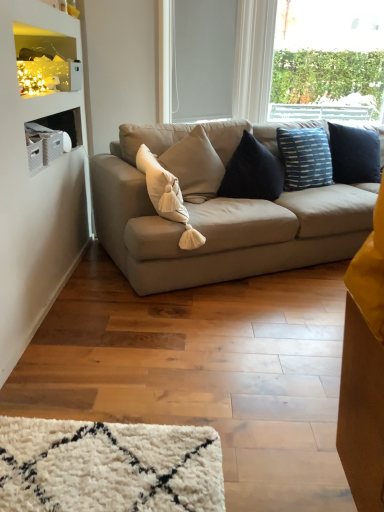
Question: From the image's perspective, is suede beige couch at center under white matte window screen at upper center?

Choices:
 (A) yes
 (B) no

Answer: (A)

Question: Considering the relative sizes of suede beige couch at center and white matte window screen at upper center in the image provided, is suede beige couch at center smaller than white matte window screen at upper center?

Choices:
 (A) no
 (B) yes

Answer: (A)

Question: From the image's perspective, does suede beige couch at center appear higher than white matte window screen at upper center?

Choices:
 (A) no
 (B) yes

Answer: (A)

Question: From a real-world perspective, is suede beige couch at center on white matte window screen at upper center?

Choices:
 (A) yes
 (B) no

Answer: (B)

Question: Is suede beige couch at center shorter than white matte window screen at upper center?

Choices:
 (A) no
 (B) yes

Answer: (B)

Question: From a real-world perspective, is suede beige couch at center beneath white matte window screen at upper center?

Choices:
 (A) no
 (B) yes

Answer: (B)

Question: Does beige fabric pillow at center have a smaller size compared to suede beige couch at center?

Choices:
 (A) yes
 (B) no

Answer: (A)

Question: From a real-world perspective, does beige fabric pillow at center sit lower than suede beige couch at center?

Choices:
 (A) no
 (B) yes

Answer: (A)

Question: Considering the relative positions of beige fabric pillow at center and suede beige couch at center in the image provided, is beige fabric pillow at center behind suede beige couch at center?

Choices:
 (A) no
 (B) yes

Answer: (B)

Question: Can you confirm if beige fabric pillow at center is taller than suede beige couch at center?

Choices:
 (A) no
 (B) yes

Answer: (A)

Question: From the image's perspective, is beige fabric pillow at center beneath suede beige couch at center?

Choices:
 (A) no
 (B) yes

Answer: (B)

Question: Would you say beige fabric pillow at center is a long distance from suede beige couch at center?

Choices:
 (A) no
 (B) yes

Answer: (A)

Question: Could you tell me if matte white shelf at upper left is facing beige fabric pillow at center?

Choices:
 (A) no
 (B) yes

Answer: (A)